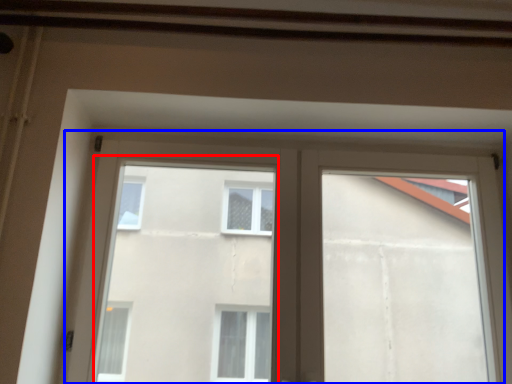
Question: Which of the following is the closest to the observer, bay window (highlighted by a red box) or window (highlighted by a blue box)?

Choices:
 (A) bay window
 (B) window

Answer: (A)